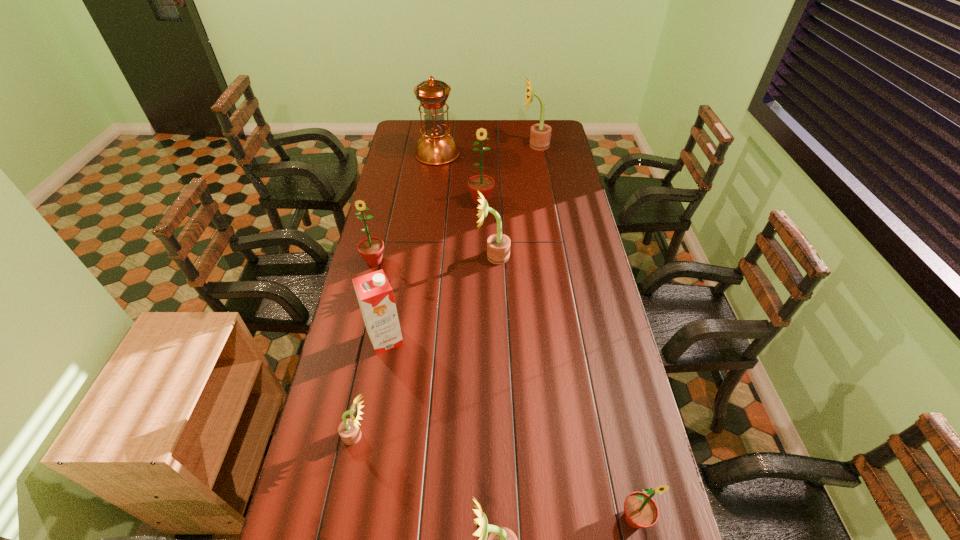
Where is `vacant space that satisfies the following two spatial constraints: 1. on the face of the rightmost yellow sunflower; 2. on the face of the second farthest green sunflower`? vacant space that satisfies the following two spatial constraints: 1. on the face of the rightmost yellow sunflower; 2. on the face of the second farthest green sunflower is located at coordinates (555, 262).